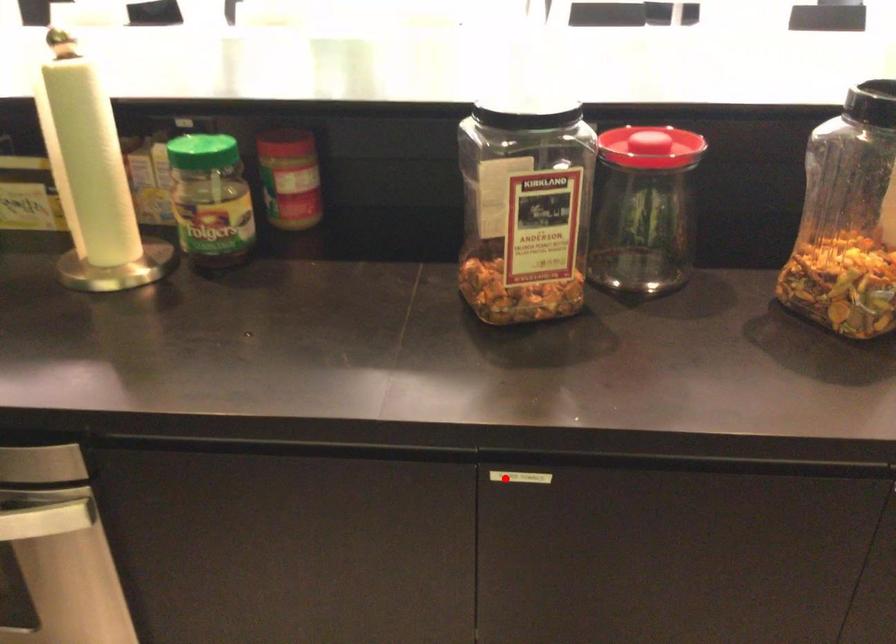
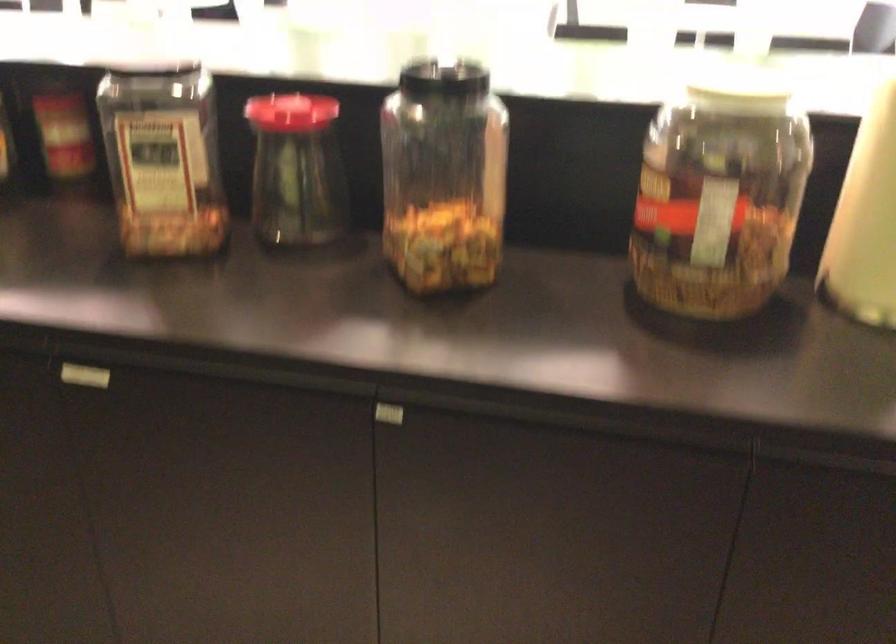
Question: I am providing you with two images of the same scene from different viewpoints. A red point is marked on the first image. Is the red point's position out of view in image 2?

Choices:
 (A) Yes
 (B) No

Answer: (B)